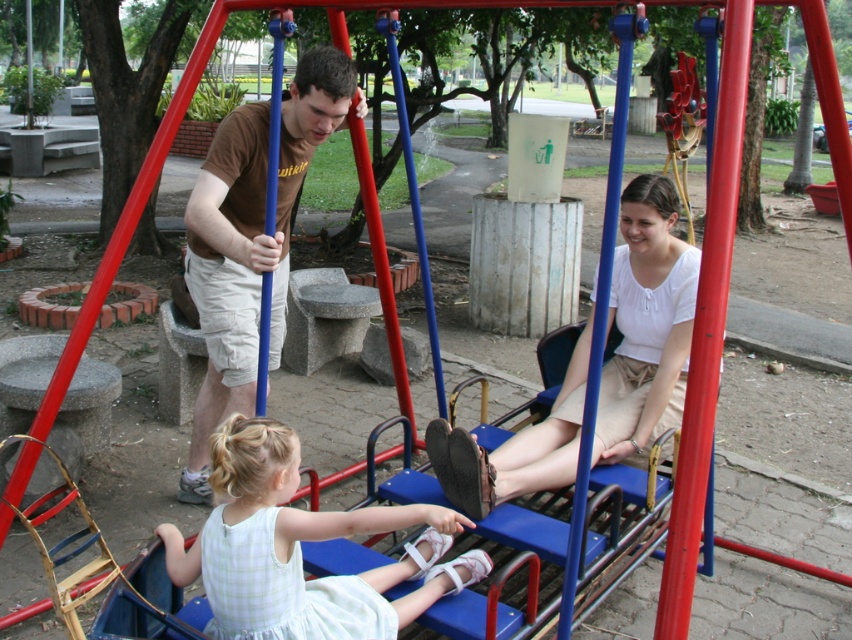
Question: Considering the real-world distances, which object is closest to the white satin dress at lower center?

Choices:
 (A) brown cotton shirt at center
 (B) white matte shirt at center

Answer: (B)

Question: Does white satin dress at lower center lie in front of white matte shirt at center?

Choices:
 (A) no
 (B) yes

Answer: (B)

Question: Can you confirm if white matte shirt at center is positioned to the left of brown cotton shirt at center?

Choices:
 (A) no
 (B) yes

Answer: (A)

Question: Based on their relative distances, which object is farther from the white satin dress at lower center?

Choices:
 (A) brown cotton shirt at center
 (B) white matte shirt at center

Answer: (A)

Question: Where is white satin dress at lower center located in relation to white matte shirt at center in the image?

Choices:
 (A) right
 (B) left

Answer: (B)

Question: Which object is closer to the camera taking this photo?

Choices:
 (A) white matte shirt at center
 (B) white satin dress at lower center

Answer: (B)